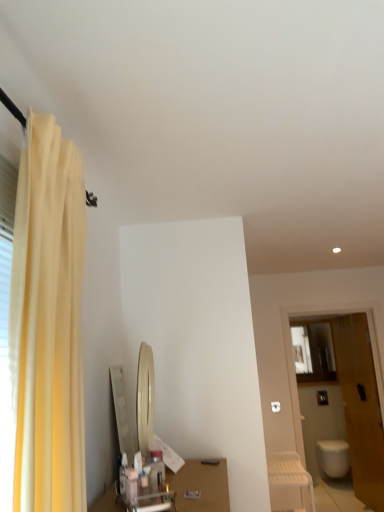
Question: Does white glossy toilet at lower right have a lesser width compared to yellow fabric curtain at left?

Choices:
 (A) no
 (B) yes

Answer: (A)

Question: Is white glossy toilet at lower right positioned beyond the bounds of yellow fabric curtain at left?

Choices:
 (A) yes
 (B) no

Answer: (A)

Question: From a real-world perspective, is white glossy toilet at lower right on yellow fabric curtain at left?

Choices:
 (A) no
 (B) yes

Answer: (A)

Question: From the image's perspective, is white glossy toilet at lower right on yellow fabric curtain at left?

Choices:
 (A) no
 (B) yes

Answer: (A)

Question: Is white glossy toilet at lower right beside yellow fabric curtain at left?

Choices:
 (A) no
 (B) yes

Answer: (A)

Question: Is white glossy toilet at lower right oriented towards yellow fabric curtain at left?

Choices:
 (A) no
 (B) yes

Answer: (B)

Question: From the image's perspective, is wooden door at right on white plastic chair at lower right?

Choices:
 (A) yes
 (B) no

Answer: (A)

Question: Does wooden door at right appear on the right side of white plastic chair at lower right?

Choices:
 (A) yes
 (B) no

Answer: (A)

Question: Does wooden door at right contain white plastic chair at lower right?

Choices:
 (A) no
 (B) yes

Answer: (A)

Question: Are wooden door at right and white plastic chair at lower right beside each other?

Choices:
 (A) no
 (B) yes

Answer: (A)

Question: Is wooden door at right oriented towards white plastic chair at lower right?

Choices:
 (A) yes
 (B) no

Answer: (B)

Question: Considering the relative sizes of wooden door at right and white plastic chair at lower right in the image provided, is wooden door at right thinner than white plastic chair at lower right?

Choices:
 (A) no
 (B) yes

Answer: (B)

Question: From the image's perspective, is wooden door at right under yellow fabric curtain at left?

Choices:
 (A) yes
 (B) no

Answer: (A)